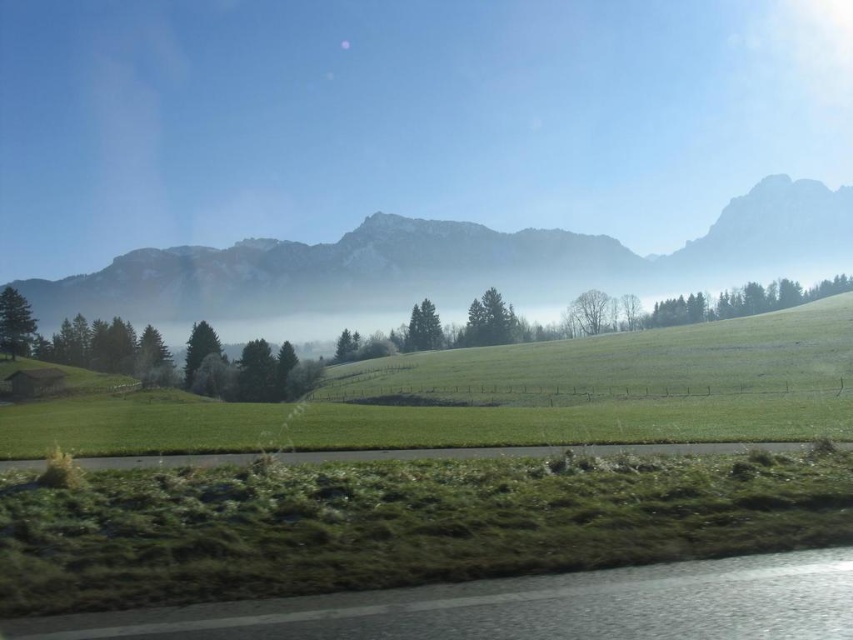
Question: Which point is closer to the camera?

Choices:
 (A) gray asphalt road at lower center
 (B) black asphalt highway at lower left
 (C) rocky gray mountain at center

Answer: (B)

Question: Can you confirm if rocky gray mountain at center is positioned to the right of gray asphalt road at lower center?

Choices:
 (A) no
 (B) yes

Answer: (B)

Question: Can you confirm if rocky gray mountain at center is bigger than gray asphalt road at lower center?

Choices:
 (A) no
 (B) yes

Answer: (B)

Question: Which object is closer to the camera taking this photo?

Choices:
 (A) rocky gray mountain at center
 (B) black asphalt highway at lower left

Answer: (B)

Question: Can you confirm if rocky gray mountain at center is positioned to the right of gray asphalt road at lower center?

Choices:
 (A) no
 (B) yes

Answer: (B)

Question: Among these objects, which one is nearest to the camera?

Choices:
 (A) black asphalt highway at lower left
 (B) rocky gray mountain at center
 (C) gray asphalt road at lower center

Answer: (A)